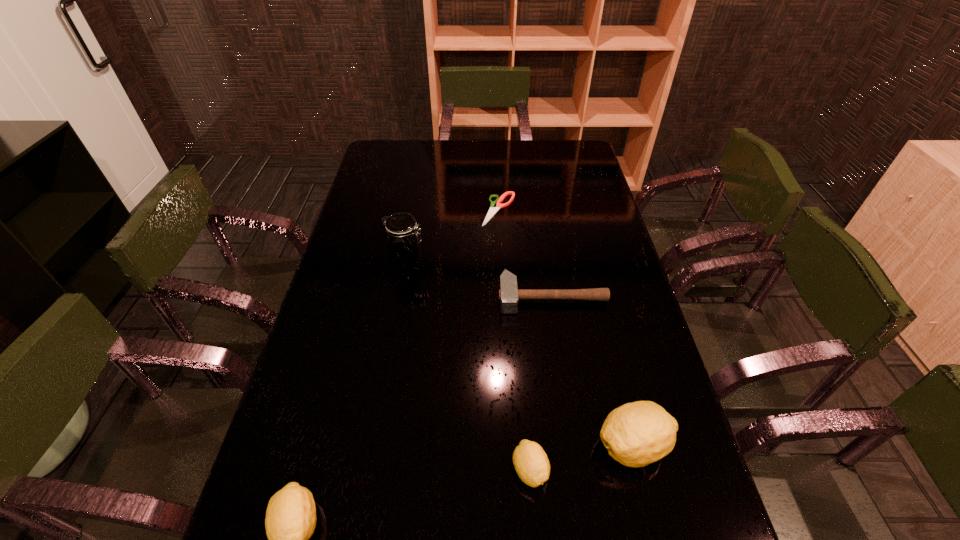
If we want them evenly spaced by inserting an extra lemon among them, please locate a free spot for this new lemon. Please provide its 2D coordinates. Your answer should be formatted as a tuple, i.e. [(x, y)], where the tuple contains the x and y coordinates of a point satisfying the conditions above.

[(419, 495)]